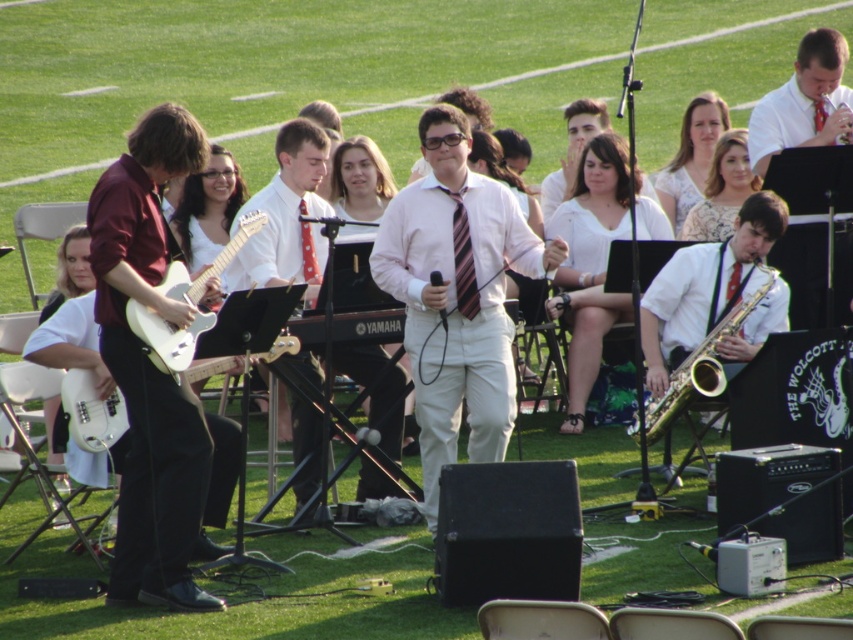
Question: Based on their relative distances, which object is farther from the white matte electric guitar at left?

Choices:
 (A) white glossy tie at center
 (B) white shirt at upper right
 (C) gold brass saxophone at right
 (D) pink satin shirt at center

Answer: (B)

Question: From the image, what is the correct spatial relationship of white shirt at upper right in relation to white matte electric guitar at left?

Choices:
 (A) right
 (B) left

Answer: (A)

Question: From the image, what is the correct spatial relationship of white glossy electric guitar at left in relation to gold brass saxophone at right?

Choices:
 (A) above
 (B) below

Answer: (B)

Question: Which point is farther to the camera?

Choices:
 (A) (421, 433)
 (B) (244, 214)
 (C) (109, 424)

Answer: (B)

Question: Which point is farther from the camera taking this photo?

Choices:
 (A) (323, 253)
 (B) (283, 348)
 (C) (840, 36)

Answer: (C)

Question: Is white matte electric guitar at left wider than gold brass saxophone at right?

Choices:
 (A) no
 (B) yes

Answer: (A)